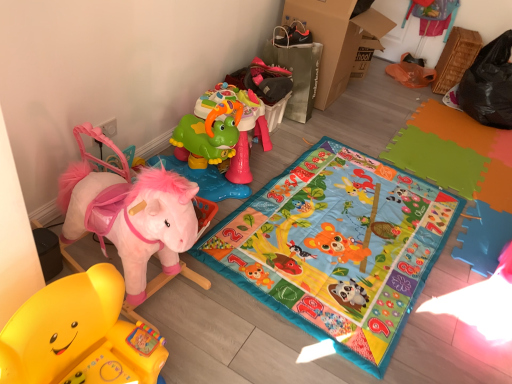
What do you see at coordinates (205, 155) in the screenshot? The height and width of the screenshot is (384, 512). I see `green plastic toy at upper center, the third toy positioned from the front` at bounding box center [205, 155].

The width and height of the screenshot is (512, 384). Identify the location of multicolored fabric play mat at center. (337, 248).

Where is `cardboard at upper right`? The image size is (512, 384). cardboard at upper right is located at coordinates (335, 39).

The width and height of the screenshot is (512, 384). What are the coordinates of `plush pink horse at left, marked as the 2th toy in a back-to-front arrangement` in the screenshot? It's located at (128, 212).

Is green plastic toy at upper center, which is counted as the 1th toy, starting from the back, looking in the opposite direction of rubber yellow rocking horse at lower left, which is the 3th toy in back-to-front order?

That's not correct — green plastic toy at upper center, which is counted as the 1th toy, starting from the back, is not looking away from rubber yellow rocking horse at lower left, which is the 3th toy in back-to-front order.

Who is bigger, green plastic toy at upper center, the third toy positioned from the front, or rubber yellow rocking horse at lower left, which is the 1th toy from front to back?

With larger size is green plastic toy at upper center, the third toy positioned from the front.

Measure the distance between green plastic toy at upper center, which is counted as the 1th toy, starting from the back, and rubber yellow rocking horse at lower left, which is the 1th toy from front to back.

38.93 inches.

Which is in front, green plastic toy at upper center, which is counted as the 1th toy, starting from the back, or rubber yellow rocking horse at lower left, which is the 3th toy in back-to-front order?

rubber yellow rocking horse at lower left, which is the 3th toy in back-to-front order.

Between green plastic toy at upper center, the third toy positioned from the front, and multicolored fabric play mat at center, which one is positioned in front?

multicolored fabric play mat at center is closer to the camera.

Between point (236, 184) and point (345, 293), which one is positioned behind?

The point (236, 184) is more distant.

Locate an element on the screen. This screenshot has height=384, width=512. yoga mat that appears on the right of green plastic toy at upper center, the third toy positioned from the front is located at coordinates (337, 248).

Considering the relative positions of plush pink horse at left, which is the second toy in front-to-back order, and cardboard at upper right in the image provided, is plush pink horse at left, which is the second toy in front-to-back order, to the left or to the right of cardboard at upper right?

plush pink horse at left, which is the second toy in front-to-back order, is positioned on cardboard at upper right's left side.

From the image's perspective, is plush pink horse at left, marked as the 2th toy in a back-to-front arrangement, positioned above or below cardboard at upper right?

From the image's perspective, plush pink horse at left, marked as the 2th toy in a back-to-front arrangement, appears below cardboard at upper right.

Who is shorter, plush pink horse at left, marked as the 2th toy in a back-to-front arrangement, or cardboard at upper right?

plush pink horse at left, marked as the 2th toy in a back-to-front arrangement.

Considering the relative positions of plush pink horse at left, marked as the 2th toy in a back-to-front arrangement, and cardboard at upper right in the image provided, is plush pink horse at left, marked as the 2th toy in a back-to-front arrangement, behind cardboard at upper right?

No, the depth of plush pink horse at left, marked as the 2th toy in a back-to-front arrangement, is less than that of cardboard at upper right.

Which object is positioned more to the right, rubber yellow rocking horse at lower left, which is the 3th toy in back-to-front order, or green plastic toy at upper center, which is counted as the 1th toy, starting from the back?

green plastic toy at upper center, which is counted as the 1th toy, starting from the back.

Could you measure the distance between rubber yellow rocking horse at lower left, which is the 1th toy from front to back, and green plastic toy at upper center, the third toy positioned from the front?

rubber yellow rocking horse at lower left, which is the 1th toy from front to back, and green plastic toy at upper center, the third toy positioned from the front, are 38.93 inches apart from each other.

Relative to green plastic toy at upper center, the third toy positioned from the front, is rubber yellow rocking horse at lower left, which is the 3th toy in back-to-front order, in front or behind?

rubber yellow rocking horse at lower left, which is the 3th toy in back-to-front order, is positioned closer to the viewer than green plastic toy at upper center, the third toy positioned from the front.

Which toy is the 1st one when counting from the left side of the green plastic toy at upper center, which is counted as the 1th toy, starting from the back? Please provide its 2D coordinates.

[(79, 335)]

Is point (196, 118) closer or farther from the camera than point (307, 5)?

Clearly, point (196, 118) is closer to the camera than point (307, 5).

Can you tell me how much green plastic toy at upper center, the third toy positioned from the front, and cardboard at upper right differ in facing direction?

The angle between the facing direction of green plastic toy at upper center, the third toy positioned from the front, and the facing direction of cardboard at upper right is 0.00109 degrees.

Considering the sizes of green plastic toy at upper center, which is counted as the 1th toy, starting from the back, and cardboard at upper right in the image, is green plastic toy at upper center, which is counted as the 1th toy, starting from the back, wider or thinner than cardboard at upper right?

Clearly, green plastic toy at upper center, which is counted as the 1th toy, starting from the back, has less width compared to cardboard at upper right.

Who is taller, green plastic toy at upper center, the third toy positioned from the front, or cardboard at upper right?

Standing taller between the two is cardboard at upper right.

Is rubber yellow rocking horse at lower left, which is the 1th toy from front to back, oriented towards multicolored fabric play mat at center?

No, rubber yellow rocking horse at lower left, which is the 1th toy from front to back, is not facing towards multicolored fabric play mat at center.

Considering the relative sizes of rubber yellow rocking horse at lower left, which is the 3th toy in back-to-front order, and multicolored fabric play mat at center in the image provided, is rubber yellow rocking horse at lower left, which is the 3th toy in back-to-front order, thinner than multicolored fabric play mat at center?

Correct, the width of rubber yellow rocking horse at lower left, which is the 3th toy in back-to-front order, is less than that of multicolored fabric play mat at center.

From a real-world perspective, which is physically below, rubber yellow rocking horse at lower left, which is the 1th toy from front to back, or multicolored fabric play mat at center?

From a 3D spatial view, multicolored fabric play mat at center is below.

Can you confirm if rubber yellow rocking horse at lower left, which is the 1th toy from front to back, is positioned to the left of multicolored fabric play mat at center?

Yes, rubber yellow rocking horse at lower left, which is the 1th toy from front to back, is to the left of multicolored fabric play mat at center.

Is multicolored fabric play mat at center bigger than cardboard at upper right?

Actually, multicolored fabric play mat at center might be smaller than cardboard at upper right.

Is multicolored fabric play mat at center outside of cardboard at upper right?

Yes, multicolored fabric play mat at center is outside of cardboard at upper right.

Is multicolored fabric play mat at center in contact with cardboard at upper right?

multicolored fabric play mat at center and cardboard at upper right are not in contact.

Considering the positions of objects multicolored fabric play mat at center and cardboard at upper right in the image provided, who is in front, multicolored fabric play mat at center or cardboard at upper right?

multicolored fabric play mat at center.

This screenshot has width=512, height=384. I want to click on the 2nd toy in front of the green plastic toy at upper center, which is counted as the 1th toy, starting from the back, so click(79, 335).

At what (x,y) coordinates should I click in order to perform the action: click on yoga mat that is below the green plastic toy at upper center, which is counted as the 1th toy, starting from the back (from the image's perspective). Please return your answer as a coordinate pair (x, y). The width and height of the screenshot is (512, 384). Looking at the image, I should click on (337, 248).

Which object lies nearer to the anchor point cardboard at upper right, green plastic toy at upper center, which is counted as the 1th toy, starting from the back, or plush pink horse at left, marked as the 2th toy in a back-to-front arrangement?

Among the two, green plastic toy at upper center, which is counted as the 1th toy, starting from the back, is located nearer to cardboard at upper right.

Estimate the real-world distances between objects in this image. Which object is further from multicolored fabric play mat at center, cardboard at upper right or plush pink horse at left, marked as the 2th toy in a back-to-front arrangement?

cardboard at upper right lies further to multicolored fabric play mat at center than the other object.

When comparing their distances from plush pink horse at left, marked as the 2th toy in a back-to-front arrangement, does green plastic toy at upper center, which is counted as the 1th toy, starting from the back, or multicolored fabric play mat at center seem closer?

green plastic toy at upper center, which is counted as the 1th toy, starting from the back, is positioned closer to the anchor plush pink horse at left, marked as the 2th toy in a back-to-front arrangement.

When comparing their distances from plush pink horse at left, marked as the 2th toy in a back-to-front arrangement, does rubber yellow rocking horse at lower left, which is the 3th toy in back-to-front order, or cardboard at upper right seem further?

cardboard at upper right.

Considering their positions, is cardboard at upper right positioned further to rubber yellow rocking horse at lower left, which is the 3th toy in back-to-front order, than plush pink horse at left, marked as the 2th toy in a back-to-front arrangement?

Based on the image, cardboard at upper right appears to be further to rubber yellow rocking horse at lower left, which is the 3th toy in back-to-front order.

Estimate the real-world distances between objects in this image. Which object is further from multicolored fabric play mat at center, cardboard at upper right or green plastic toy at upper center, the third toy positioned from the front?

cardboard at upper right is further to multicolored fabric play mat at center.

When comparing their distances from multicolored fabric play mat at center, does rubber yellow rocking horse at lower left, which is the 3th toy in back-to-front order, or green plastic toy at upper center, the third toy positioned from the front, seem closer?

green plastic toy at upper center, the third toy positioned from the front, lies closer to multicolored fabric play mat at center than the other object.

Which object lies nearer to the anchor point plush pink horse at left, marked as the 2th toy in a back-to-front arrangement, green plastic toy at upper center, which is counted as the 1th toy, starting from the back, or cardboard at upper right?

green plastic toy at upper center, which is counted as the 1th toy, starting from the back.

The image size is (512, 384). I want to click on toy between rubber yellow rocking horse at lower left, which is the 3th toy in back-to-front order, and multicolored fabric play mat at center from left to right, so click(x=205, y=155).

Where is `toy between rubber yellow rocking horse at lower left, which is the 3th toy in back-to-front order, and green plastic toy at upper center, which is counted as the 1th toy, starting from the back, along the z-axis`? toy between rubber yellow rocking horse at lower left, which is the 3th toy in back-to-front order, and green plastic toy at upper center, which is counted as the 1th toy, starting from the back, along the z-axis is located at coordinates (128, 212).

The height and width of the screenshot is (384, 512). In order to click on yoga mat between cardboard at upper right and rubber yellow rocking horse at lower left, which is the 3th toy in back-to-front order, vertically in this screenshot , I will do `click(337, 248)`.

Find the location of a particular element. This screenshot has width=512, height=384. toy between plush pink horse at left, marked as the 2th toy in a back-to-front arrangement, and cardboard at upper right in the front-back direction is located at coordinates (205, 155).